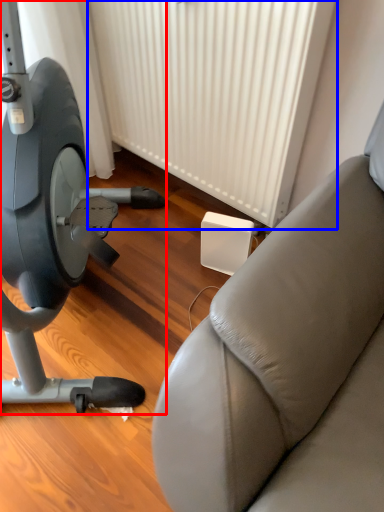
Question: Among these objects, which one is farthest to the camera, stationary bicycle (highlighted by a red box) or radiator (highlighted by a blue box)?

Choices:
 (A) stationary bicycle
 (B) radiator

Answer: (B)